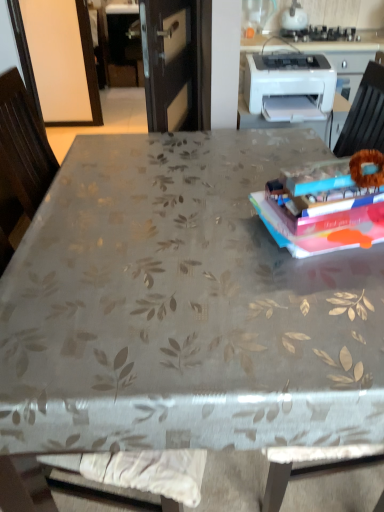
Describe the element at coordinates (289, 86) in the screenshot. I see `white plastic printer at upper right` at that location.

What do you see at coordinates (326, 205) in the screenshot? The width and height of the screenshot is (384, 512). I see `hardcover book at upper right` at bounding box center [326, 205].

Identify the location of white glossy kettle at upper center. [294, 17].

From a real-world perspective, who is located lower, white glossy countertop at upper center or white plastic printer at upper right?

white plastic printer at upper right is physically lower.

Consider the image. Considering the sizes of objects white glossy countertop at upper center and white plastic printer at upper right in the image provided, who is taller, white glossy countertop at upper center or white plastic printer at upper right?

white plastic printer at upper right.

Is white glossy countertop at upper center positioned with its back to white plastic printer at upper right?

white glossy countertop at upper center is not turned away from white plastic printer at upper right.

Find the location of a particular element. This screenshot has height=512, width=384. printer below the white glossy countertop at upper center (from a real-world perspective) is located at coordinates (289, 86).

This screenshot has width=384, height=512. Find the location of `paperback book directly beneath the white glossy kettle at upper center (from a real-world perspective)`. paperback book directly beneath the white glossy kettle at upper center (from a real-world perspective) is located at coordinates (326, 205).

Between hardcover book at upper right and white glossy kettle at upper center, which one has smaller size?

Smaller between the two is hardcover book at upper right.

Consider the image. Considering the relative positions of hardcover book at upper right and white glossy kettle at upper center in the image provided, is hardcover book at upper right to the right of white glossy kettle at upper center from the viewer's perspective?

No.

Which is nearer, (302,213) or (303,12)?

Point (302,213).

Is hardcover book at upper right inside white glossy countertop at upper center?

No, hardcover book at upper right is not surrounded by white glossy countertop at upper center.

From the picture: Looking at their sizes, would you say white glossy countertop at upper center is wider or thinner than hardcover book at upper right?

Considering their sizes, white glossy countertop at upper center looks broader than hardcover book at upper right.

Is point (283, 37) positioned after point (358, 196)?

Yes.

Is white glossy countertop at upper center oriented towards white glossy kettle at upper center?

No, white glossy countertop at upper center does not turn towards white glossy kettle at upper center.

From a real-world perspective, is white glossy countertop at upper center located beneath white glossy kettle at upper center?

Yes, from a real-world perspective, white glossy countertop at upper center is below white glossy kettle at upper center.

Which is in front, point (360, 50) or point (303, 14)?

The point (360, 50) is closer to the camera.

Can you confirm if white glossy countertop at upper center is positioned to the right of white glossy kettle at upper center?

Correct, you'll find white glossy countertop at upper center to the right of white glossy kettle at upper center.

Find the location of a particular element. paperback book on the left side of white plastic printer at upper right is located at coordinates (326, 205).

Measure the distance between hardcover book at upper right and white plastic printer at upper right.

38.28 inches.

From the picture: From the image's perspective, between hardcover book at upper right and white plastic printer at upper right, who is located below?

From the image's view, hardcover book at upper right is below.

Does hardcover book at upper right appear on the left side of white plastic printer at upper right?

Indeed, hardcover book at upper right is positioned on the left side of white plastic printer at upper right.

Is white glossy kettle at upper center at the right side of white glossy countertop at upper center?

In fact, white glossy kettle at upper center is to the left of white glossy countertop at upper center.

In the image, is white glossy kettle at upper center positioned in front of or behind white glossy countertop at upper center?

In the image, white glossy kettle at upper center appears behind white glossy countertop at upper center.

Is there a large distance between white glossy kettle at upper center and white glossy countertop at upper center?

No, white glossy kettle at upper center is not far from white glossy countertop at upper center.

You are a GUI agent. You are given a task and a screenshot of the screen. Output one action in this format:
    pyautogui.click(x=<x>, y=<y>)
    Task: Click on the kitchen appliance above the white glossy countertop at upper center (from the image's perspective)
    
    Given the screenshot: What is the action you would take?
    pyautogui.click(x=294, y=17)

Is point (307, 84) closer or farther from the camera than point (321, 38)?

Clearly, point (307, 84) is closer to the camera than point (321, 38).

Between white plastic printer at upper right and white glossy countertop at upper center, which one is positioned behind?

white glossy countertop at upper center.

Is white plastic printer at upper right positioned far away from white glossy countertop at upper center?

No, white plastic printer at upper right is not far from white glossy countertop at upper center.

Which of these two, white plastic printer at upper right or white glossy countertop at upper center, stands taller?

With more height is white plastic printer at upper right.

Locate an element on the screen. The width and height of the screenshot is (384, 512). counter top lying on the right of white plastic printer at upper right is located at coordinates (320, 41).

I want to click on paperback book in front of the white glossy kettle at upper center, so click(326, 205).

Estimate the real-world distances between objects in this image. Which object is closer to white glossy countertop at upper center, white glossy kettle at upper center or white plastic printer at upper right?

white glossy kettle at upper center.

Which object lies nearer to the anchor point white plastic printer at upper right, white glossy countertop at upper center or white glossy kettle at upper center?

Among the two, white glossy countertop at upper center is located nearer to white plastic printer at upper right.

Looking at the image, which one is located further to white glossy countertop at upper center, hardcover book at upper right or white glossy kettle at upper center?

hardcover book at upper right is further to white glossy countertop at upper center.

Considering their positions, is white glossy countertop at upper center positioned closer to white glossy kettle at upper center than white plastic printer at upper right?

Based on the image, white glossy countertop at upper center appears to be nearer to white glossy kettle at upper center.

From the image, which object appears to be farther from hardcover book at upper right, white glossy countertop at upper center or white plastic printer at upper right?

white glossy countertop at upper center is further to hardcover book at upper right.

From the picture: Based on their spatial positions, is white glossy kettle at upper center or hardcover book at upper right closer to white glossy countertop at upper center?

white glossy kettle at upper center is positioned closer to the anchor white glossy countertop at upper center.

Considering their positions, is white plastic printer at upper right positioned further to hardcover book at upper right than white glossy kettle at upper center?

The object further to hardcover book at upper right is white glossy kettle at upper center.

From the image, which object appears to be nearer to white glossy countertop at upper center, white plastic printer at upper right or hardcover book at upper right?

Among the two, white plastic printer at upper right is located nearer to white glossy countertop at upper center.

This screenshot has width=384, height=512. Identify the location of printer between hardcover book at upper right and white glossy countertop at upper center along the z-axis. (289, 86).

The height and width of the screenshot is (512, 384). What are the coordinates of `counter top between white plastic printer at upper right and white glossy kettle at upper center from front to back` in the screenshot? It's located at (320, 41).

Locate an element on the screen. Image resolution: width=384 pixels, height=512 pixels. counter top located between hardcover book at upper right and white glossy kettle at upper center in the depth direction is located at coordinates (320, 41).

Locate an element on the screen. Image resolution: width=384 pixels, height=512 pixels. printer located between hardcover book at upper right and white glossy kettle at upper center in the depth direction is located at coordinates (289, 86).